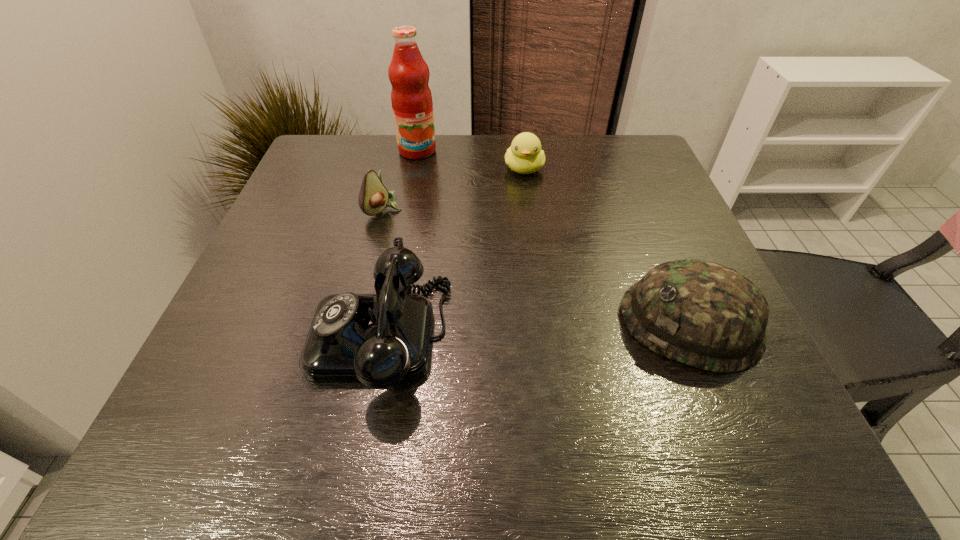
The width and height of the screenshot is (960, 540). In the image, there is a desktop. Identify the location of free space at the near right corner. (763, 382).

At what (x,y) coordinates should I click in order to perform the action: click on free space between the tallest object and the shortest object. Please return your answer as a coordinate pair (x, y). The width and height of the screenshot is (960, 540). Looking at the image, I should click on (470, 160).

The height and width of the screenshot is (540, 960). What are the coordinates of `empty location between the telephone and the rightmost object` in the screenshot? It's located at (535, 329).

The width and height of the screenshot is (960, 540). Identify the location of free space between the tallest object and the avocado. (400, 180).

Locate an element on the screen. free space between the shortest object and the third farthest object is located at coordinates (454, 188).

This screenshot has width=960, height=540. Identify the location of blank region between the shortest object and the telephone. (452, 252).

The width and height of the screenshot is (960, 540). I want to click on free space between the shortest object and the telephone, so click(x=452, y=252).

The image size is (960, 540). In order to click on the fourth closest object to the telephone in this screenshot , I will do `click(411, 98)`.

Identify the location of the closest object to the tallest object. This screenshot has width=960, height=540. (373, 197).